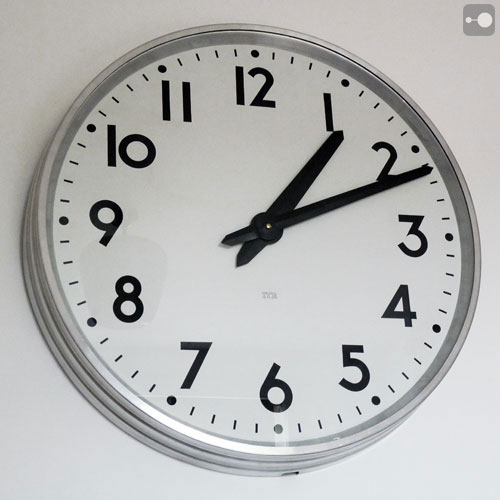
You are a GUI agent. You are given a task and a screenshot of the screen. Output one action in this format:
    pyautogui.click(x=<x>, y=<y>)
    Task: Click on the greyish wall
    
    Given the screenshot: What is the action you would take?
    pyautogui.click(x=48, y=41)